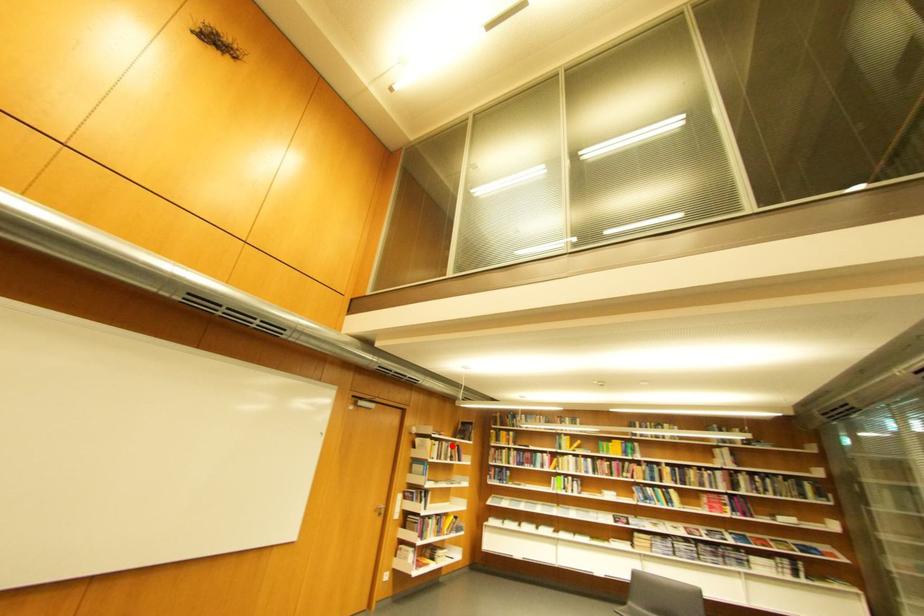
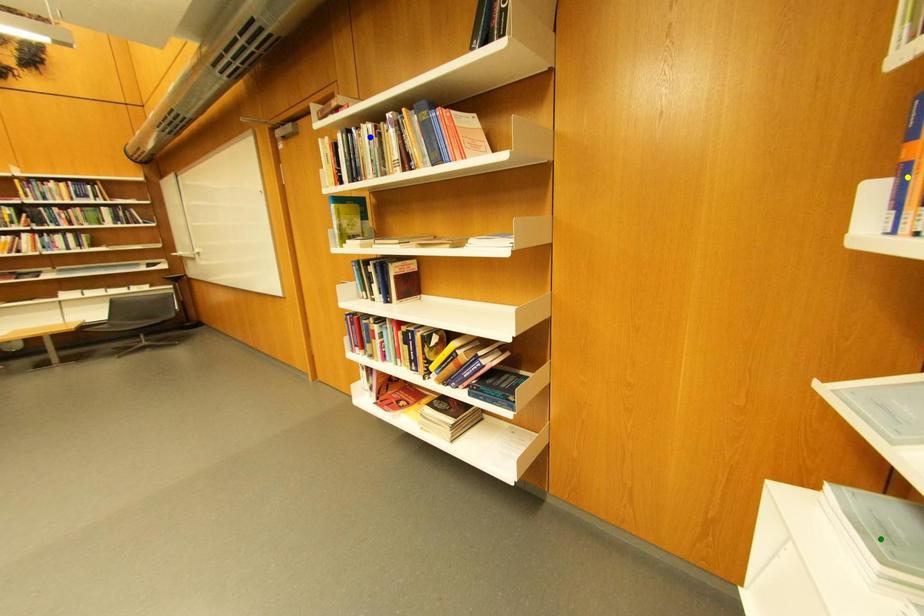
Question: I am providing you with two images of the same scene from different viewpoints. A red point is marked on the first image. You are given multiple points on the second image. Which point in image 2 represents the same 3d spot as the red point in image 1?

Choices:
 (A) blue point
 (B) yellow point
 (C) green point

Answer: (A)